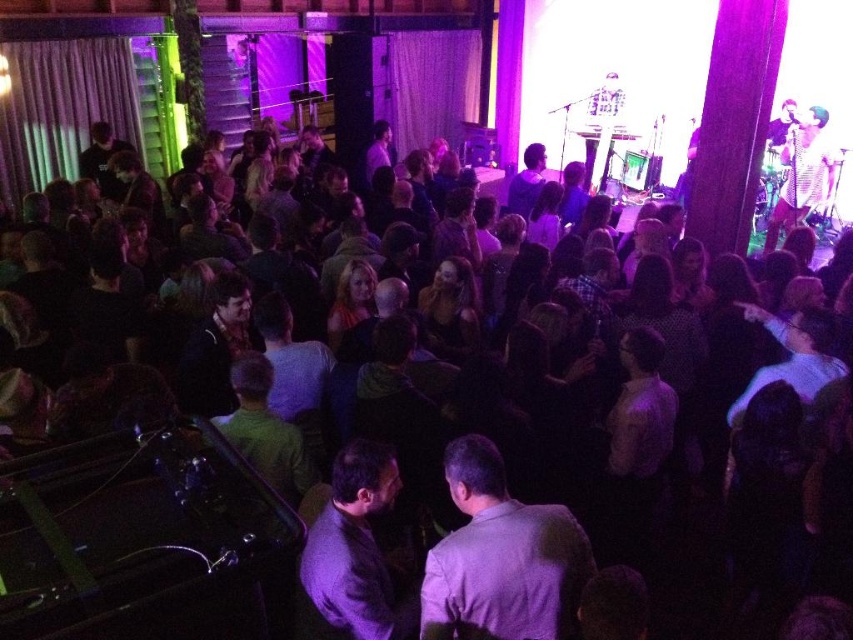
Which of these two, light purple shirt at center or dark gray suit at center, stands shorter?

light purple shirt at center

What do you see at coordinates (500, 557) in the screenshot?
I see `light purple shirt at center` at bounding box center [500, 557].

The image size is (853, 640). Identify the location of light purple shirt at center. (500, 557).